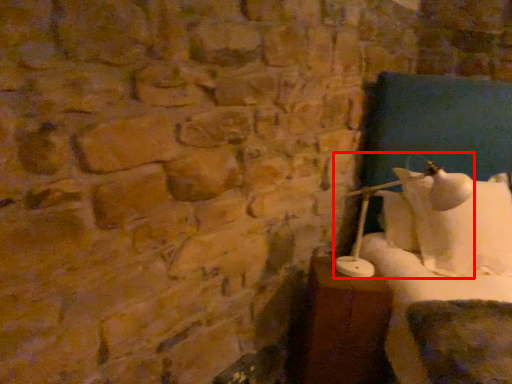
Question: Where is table lamp (annotated by the red box) located in relation to furniture in the image?

Choices:
 (A) right
 (B) left

Answer: (A)